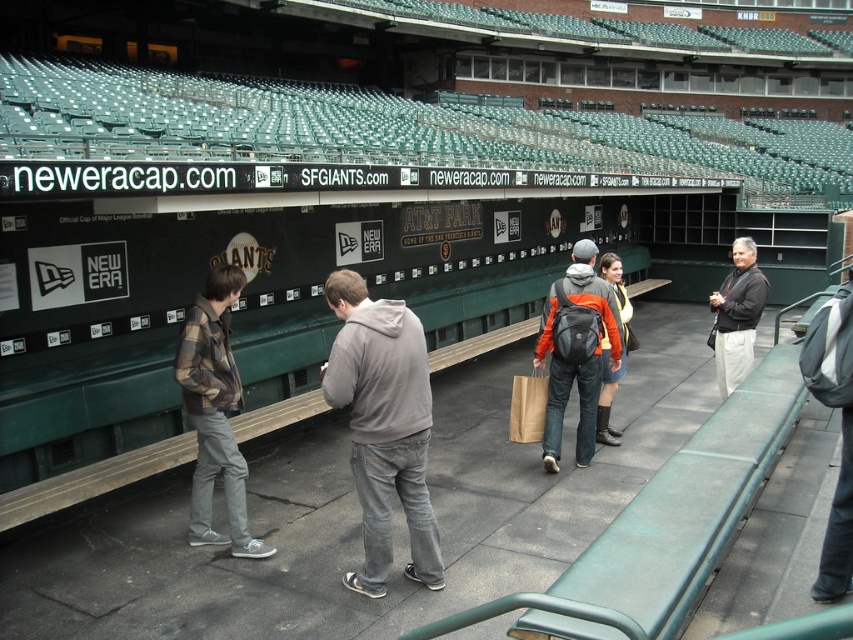
Consider the image. Which of these two, orange fabric jacket at center or metallic silver scoreboard at center, stands taller?

With more height is orange fabric jacket at center.

How far apart are orange fabric jacket at center and metallic silver scoreboard at center?

orange fabric jacket at center and metallic silver scoreboard at center are 4.81 meters apart.

Does point (554, 460) come in front of point (462, 237)?

Yes, it is in front of point (462, 237).

The width and height of the screenshot is (853, 640). Identify the location of orange fabric jacket at center. (576, 349).

Does khaki pants at right lie behind orange fleece jacket at center?

That is True.

Measure the distance between point (741, 252) and camera.

7.07 meters

What do you see at coordinates (737, 316) in the screenshot? I see `khaki pants at right` at bounding box center [737, 316].

Locate an element on the screen. khaki pants at right is located at coordinates [737, 316].

Based on the photo, which is above, green plastic bleachers at upper center or plaid flannel shirt at left?

green plastic bleachers at upper center

Is green plastic bleachers at upper center taller than plaid flannel shirt at left?

Yes, green plastic bleachers at upper center is taller than plaid flannel shirt at left.

Is point (578, 147) less distant than point (224, 428)?

That is False.

In order to click on green plastic bleachers at upper center in this screenshot , I will do `click(387, 129)`.